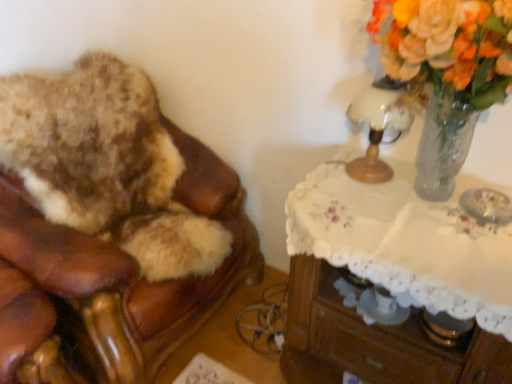
Question: Does white glass table lamp at upper right appear on the left side of translucent glass vase at upper right?

Choices:
 (A) yes
 (B) no

Answer: (A)

Question: Does white glass table lamp at upper right come in front of translucent glass vase at upper right?

Choices:
 (A) no
 (B) yes

Answer: (A)

Question: Is white glass table lamp at upper right facing towards translucent glass vase at upper right?

Choices:
 (A) no
 (B) yes

Answer: (B)

Question: Does white glass table lamp at upper right appear on the right side of translucent glass vase at upper right?

Choices:
 (A) no
 (B) yes

Answer: (A)

Question: From a real-world perspective, is white glass table lamp at upper right located higher than translucent glass vase at upper right?

Choices:
 (A) yes
 (B) no

Answer: (B)

Question: Does white glass table lamp at upper right lie behind translucent glass vase at upper right?

Choices:
 (A) yes
 (B) no

Answer: (A)

Question: Are translucent glass vase at upper right and white lace-covered table at upper right located far from each other?

Choices:
 (A) yes
 (B) no

Answer: (B)

Question: Does translucent glass vase at upper right have a greater width compared to white lace-covered table at upper right?

Choices:
 (A) no
 (B) yes

Answer: (A)

Question: Can you confirm if translucent glass vase at upper right is smaller than white lace-covered table at upper right?

Choices:
 (A) no
 (B) yes

Answer: (A)

Question: Is translucent glass vase at upper right not inside white lace-covered table at upper right?

Choices:
 (A) yes
 (B) no

Answer: (A)

Question: From the image's perspective, does translucent glass vase at upper right appear higher than white lace-covered table at upper right?

Choices:
 (A) yes
 (B) no

Answer: (A)

Question: Can you confirm if translucent glass vase at upper right is bigger than white lace-covered table at upper right?

Choices:
 (A) no
 (B) yes

Answer: (B)

Question: Is translucent glass vase at upper right oriented away from brown leather chair at left?

Choices:
 (A) yes
 (B) no

Answer: (B)